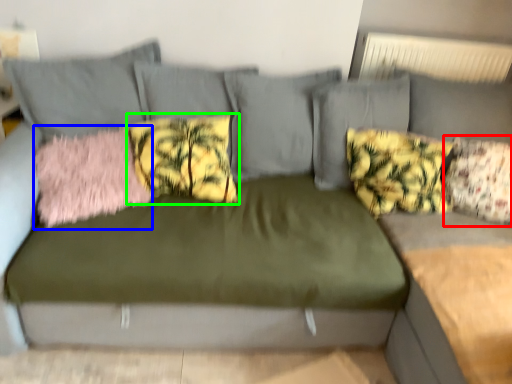
Question: Based on their relative distances, which object is nearer to pillow (highlighted by a red box)? Choose from pillow (highlighted by a blue box) and pillow (highlighted by a green box).

Choices:
 (A) pillow
 (B) pillow

Answer: (B)